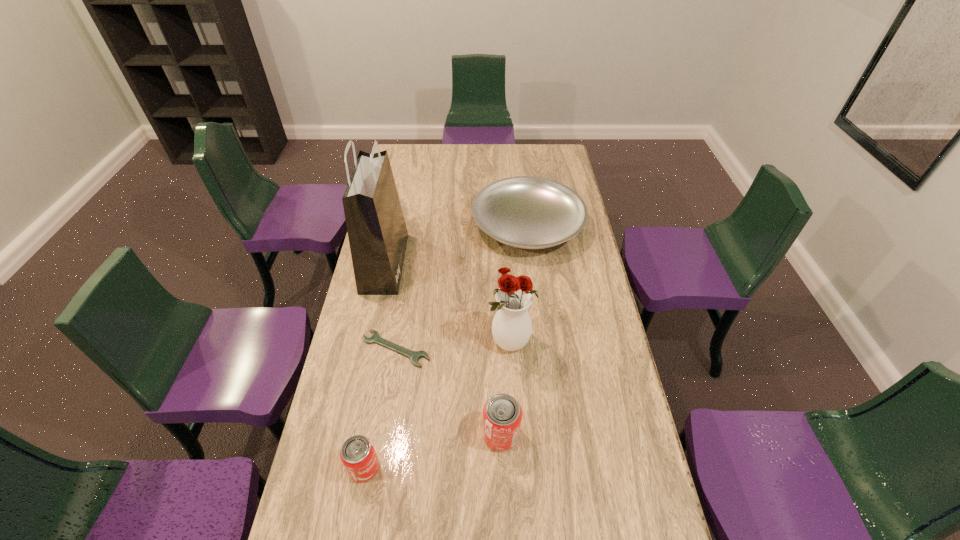
I want to click on free space located 0.290m on the front of the bedpan, so click(x=539, y=323).

Identify the location of vacant space located on the front with handles of the shopping bag. This screenshot has width=960, height=540. (502, 263).

Where is `blank space located on the back of the second tallest object`? blank space located on the back of the second tallest object is located at coordinates (505, 271).

Where is `vacant space positioned on the right of the wrench`? vacant space positioned on the right of the wrench is located at coordinates (458, 349).

Locate an element on the screen. can that is at the left edge is located at coordinates (358, 455).

The height and width of the screenshot is (540, 960). In order to click on shopping bag that is at the left edge in this screenshot , I will do `click(377, 232)`.

Find the location of a particular element. This screenshot has height=540, width=960. wrench that is at the left edge is located at coordinates (414, 356).

You are a GUI agent. You are given a task and a screenshot of the screen. Output one action in this format:
    pyautogui.click(x=<x>, y=<y>)
    Task: Click on the object present at the right edge
    The height and width of the screenshot is (540, 960).
    Given the screenshot: What is the action you would take?
    pyautogui.click(x=527, y=212)

Find the location of a particular element. vacant area at the far edge of the desktop is located at coordinates (481, 160).

Identify the location of vacant space at the near edge of the desktop. (396, 501).